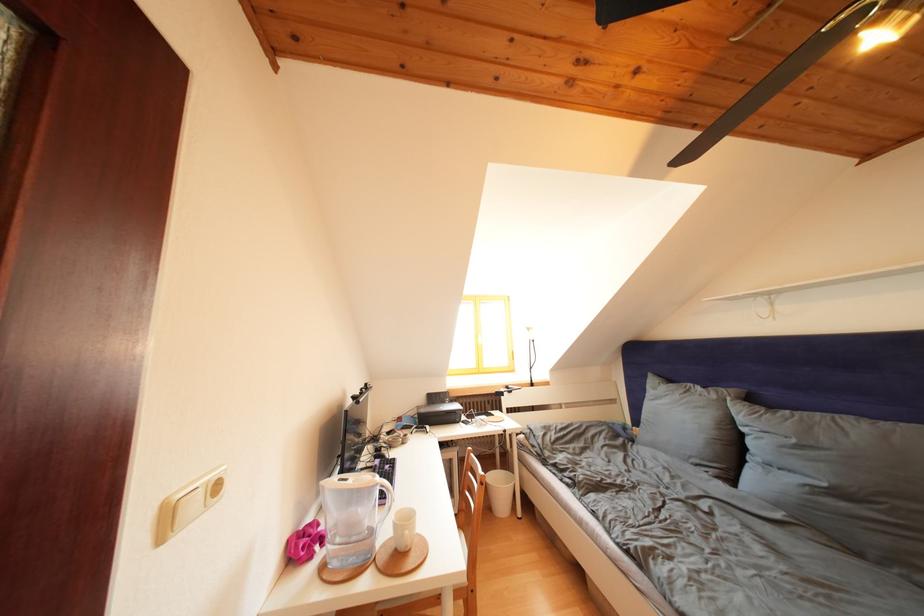
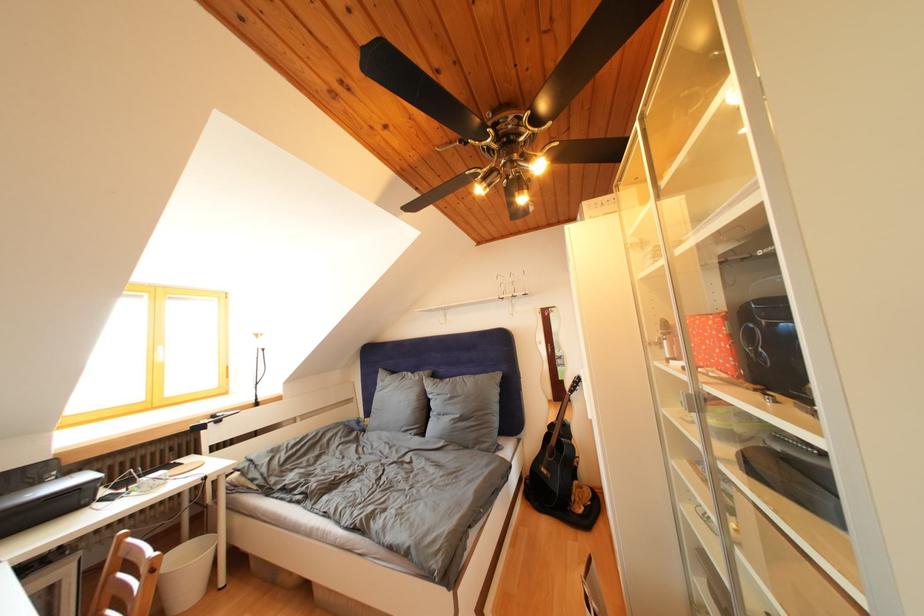
Question: Based on the continuous images, in which direction is the camera rotating? Reply with the corresponding letter.

Choices:
 (A) Left
 (B) Right
 (C) Up
 (D) Down

Answer: (B)